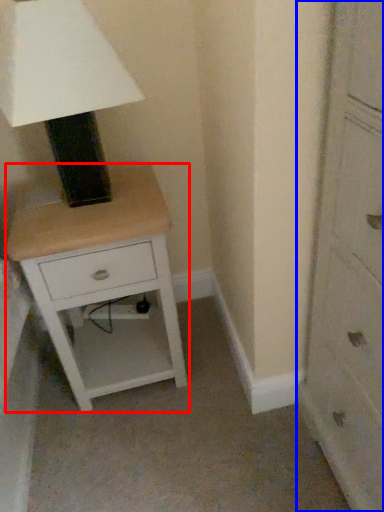
Question: Which point is closer to the camera, nightstand (highlighted by a red box) or chest of drawers (highlighted by a blue box)?

Choices:
 (A) nightstand
 (B) chest of drawers

Answer: (B)